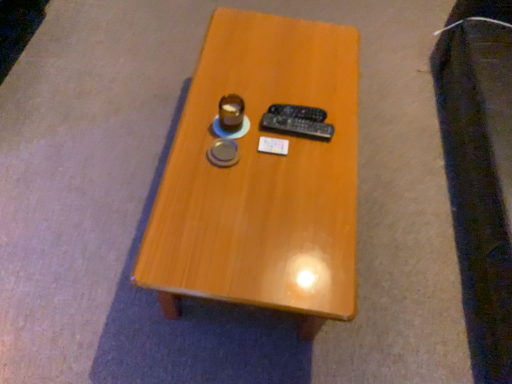
Question: Is wooden table at center next to black plastic remote control at center, arranged as the 1th remote control when viewed from the back, and touching it?

Choices:
 (A) yes
 (B) no

Answer: (B)

Question: From the image's perspective, would you say wooden table at center is shown under black plastic remote control at center, marked as the second remote control in a front-to-back arrangement?

Choices:
 (A) no
 (B) yes

Answer: (B)

Question: From a real-world perspective, is wooden table at center located beneath black plastic remote control at center, arranged as the 1th remote control when viewed from the back?

Choices:
 (A) no
 (B) yes

Answer: (B)

Question: Can you confirm if wooden table at center is wider than black plastic remote control at center, marked as the second remote control in a front-to-back arrangement?

Choices:
 (A) yes
 (B) no

Answer: (A)

Question: Does wooden table at center come in front of black plastic remote control at center, marked as the second remote control in a front-to-back arrangement?

Choices:
 (A) yes
 (B) no

Answer: (A)

Question: In terms of size, does matte brown coffee cup at center appear bigger or smaller than black plastic remote control at center, which is counted as the second remote control, starting from the back?

Choices:
 (A) small
 (B) big

Answer: (B)

Question: Is matte brown coffee cup at center taller or shorter than black plastic remote control at center, arranged as the first remote control when viewed from the front?

Choices:
 (A) short
 (B) tall

Answer: (B)

Question: Would you say matte brown coffee cup at center is to the left or to the right of black plastic remote control at center, which is counted as the second remote control, starting from the back, in the picture?

Choices:
 (A) right
 (B) left

Answer: (B)

Question: From the image's perspective, is matte brown coffee cup at center positioned above or below black plastic remote control at center, which is counted as the second remote control, starting from the back?

Choices:
 (A) below
 (B) above

Answer: (B)

Question: From the image's perspective, is matte brown coffee cup at center above or below wooden table at center?

Choices:
 (A) below
 (B) above

Answer: (B)

Question: Based on their positions, is matte brown coffee cup at center located to the left or right of wooden table at center?

Choices:
 (A) right
 (B) left

Answer: (B)

Question: Is point (236, 94) closer or farther from the camera than point (285, 294)?

Choices:
 (A) farther
 (B) closer

Answer: (A)

Question: Looking at the image, does matte brown coffee cup at center seem bigger or smaller compared to wooden table at center?

Choices:
 (A) big
 (B) small

Answer: (B)

Question: Is black plastic remote control at center, arranged as the 1th remote control when viewed from the back, to the left or to the right of matte brown coffee cup at center in the image?

Choices:
 (A) right
 (B) left

Answer: (A)

Question: Is black plastic remote control at center, marked as the second remote control in a front-to-back arrangement, bigger or smaller than matte brown coffee cup at center?

Choices:
 (A) small
 (B) big

Answer: (A)